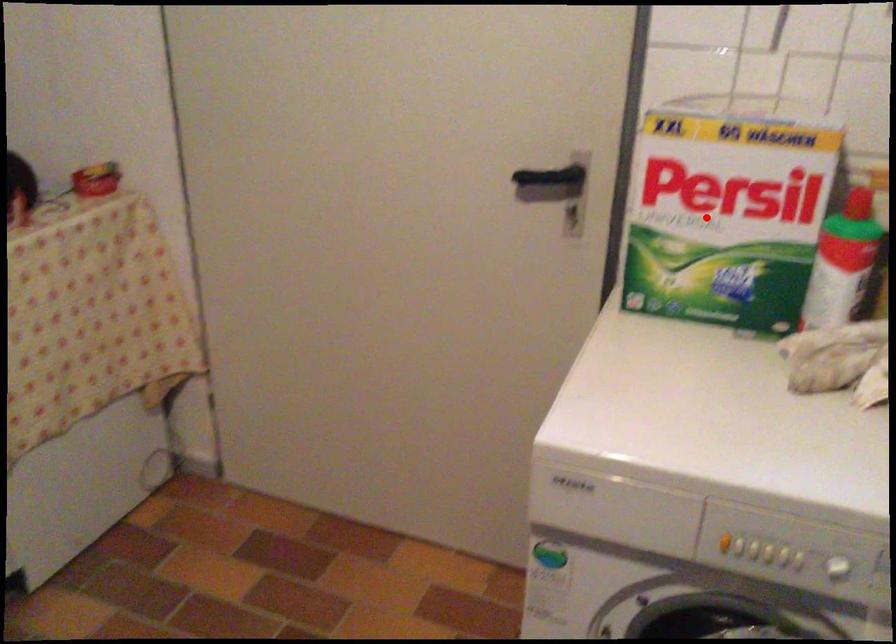
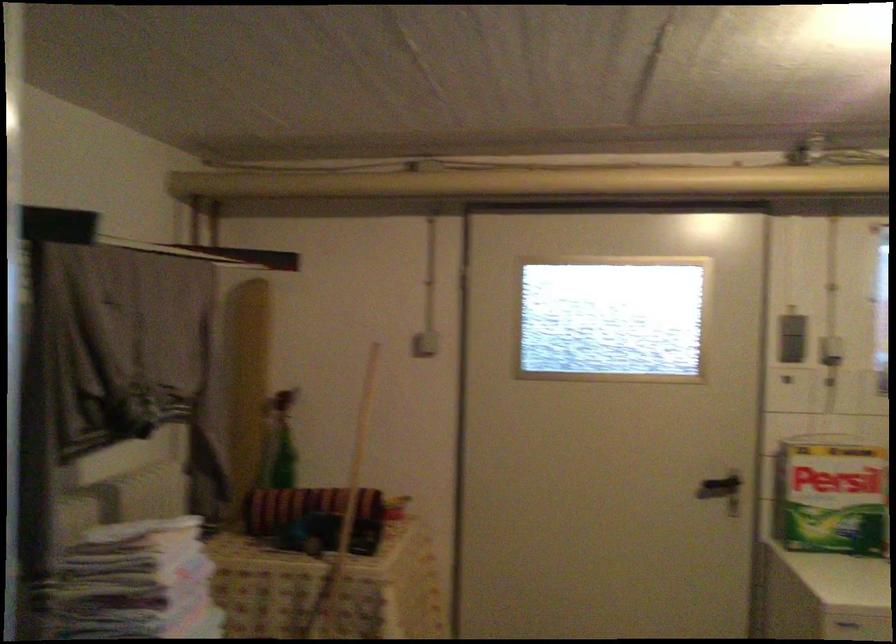
Find the pixel in the second image that matches the highlighted location in the first image.

(831, 496)